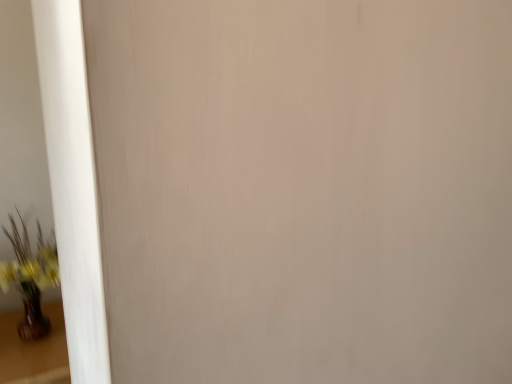
Question: Is point (44, 332) closer or farther from the camera than point (25, 365)?

Choices:
 (A) farther
 (B) closer

Answer: (A)

Question: Do you think matte brown vase at lower left is within brown glossy vase at lower left, or outside of it?

Choices:
 (A) inside
 (B) outside

Answer: (B)

Question: From the image's perspective, relative to brown glossy vase at lower left, is matte brown vase at lower left above or below?

Choices:
 (A) below
 (B) above

Answer: (B)

Question: From the image's perspective, is brown glossy vase at lower left positioned above or below matte brown vase at lower left?

Choices:
 (A) above
 (B) below

Answer: (B)

Question: Considering the positions of point (31, 367) and point (46, 329), is point (31, 367) closer or farther from the camera than point (46, 329)?

Choices:
 (A) farther
 (B) closer

Answer: (B)

Question: Considering the relative positions of brown glossy vase at lower left and matte brown vase at lower left in the image provided, is brown glossy vase at lower left to the left or to the right of matte brown vase at lower left?

Choices:
 (A) right
 (B) left

Answer: (B)

Question: From a real-world perspective, is brown glossy vase at lower left above or below matte brown vase at lower left?

Choices:
 (A) below
 (B) above

Answer: (A)